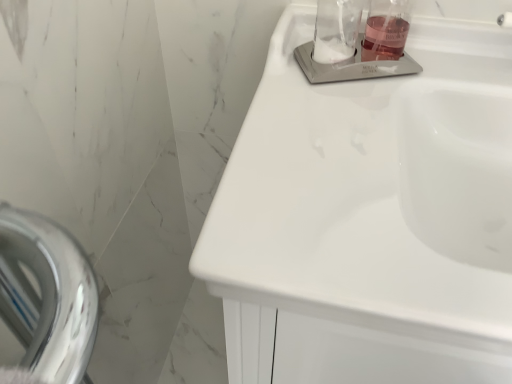
Question: Can you confirm if clear glass soap dispenser at upper right, which is the first sink in back-to-front order, is positioned to the right of clear glass jar at upper center?

Choices:
 (A) yes
 (B) no

Answer: (A)

Question: Does clear glass soap dispenser at upper right, positioned as the second sink in front-to-back order, lie in front of clear glass jar at upper center?

Choices:
 (A) no
 (B) yes

Answer: (A)

Question: Can you confirm if clear glass soap dispenser at upper right, the first sink in the top-to-bottom sequence, is taller than clear glass jar at upper center?

Choices:
 (A) no
 (B) yes

Answer: (A)

Question: Is clear glass soap dispenser at upper right, positioned as the second sink in front-to-back order, not inside clear glass jar at upper center?

Choices:
 (A) no
 (B) yes

Answer: (B)

Question: Can clear glass jar at upper center be found inside clear glass soap dispenser at upper right, which is the first sink in back-to-front order?

Choices:
 (A) yes
 (B) no

Answer: (B)

Question: Considering the positions of clear glass soap dispenser at upper right, which is the first sink in back-to-front order, and translucent glass liquid at upper right in the image, is clear glass soap dispenser at upper right, which is the first sink in back-to-front order, wider or thinner than translucent glass liquid at upper right?

Choices:
 (A) thin
 (B) wide

Answer: (B)

Question: Is clear glass soap dispenser at upper right, the 2th sink ordered from the bottom, bigger or smaller than translucent glass liquid at upper right?

Choices:
 (A) big
 (B) small

Answer: (A)

Question: In the image, is clear glass soap dispenser at upper right, positioned as the second sink in front-to-back order, on the left side or the right side of translucent glass liquid at upper right?

Choices:
 (A) right
 (B) left

Answer: (B)

Question: Is clear glass soap dispenser at upper right, the first sink in the top-to-bottom sequence, taller or shorter than translucent glass liquid at upper right?

Choices:
 (A) tall
 (B) short

Answer: (B)

Question: Choose the correct answer: Is clear glass jar at upper center inside translucent glass liquid at upper right or outside it?

Choices:
 (A) inside
 (B) outside

Answer: (B)

Question: Considering the positions of clear glass jar at upper center and translucent glass liquid at upper right in the image, is clear glass jar at upper center taller or shorter than translucent glass liquid at upper right?

Choices:
 (A) tall
 (B) short

Answer: (A)

Question: From a real-world perspective, is clear glass jar at upper center physically located above or below translucent glass liquid at upper right?

Choices:
 (A) below
 (B) above

Answer: (B)

Question: From the image's perspective, is clear glass jar at upper center positioned above or below translucent glass liquid at upper right?

Choices:
 (A) below
 (B) above

Answer: (A)

Question: From the image's perspective, relative to clear glass jar at upper center, is translucent glass liquid at upper right above or below?

Choices:
 (A) above
 (B) below

Answer: (A)

Question: Considering their positions, is translucent glass liquid at upper right located in front of or behind clear glass jar at upper center?

Choices:
 (A) behind
 (B) front

Answer: (A)